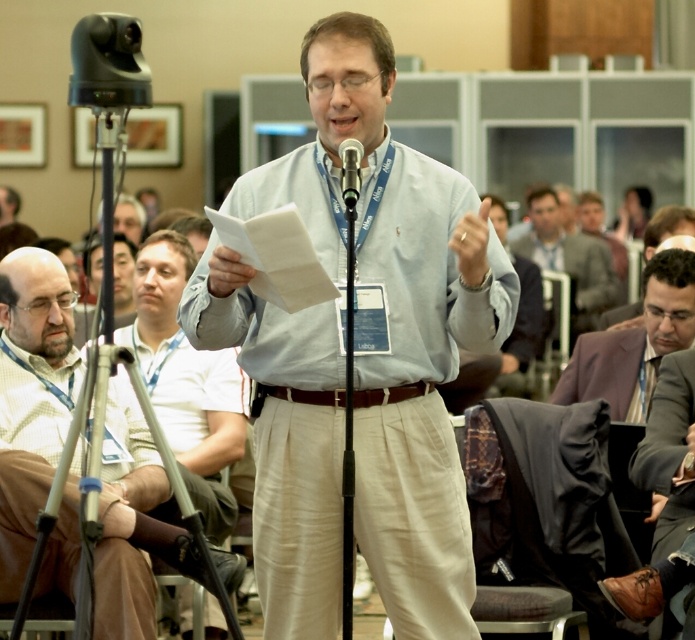
You are organizing a photoshoot and need to ensure that the light blue shirt at center and the light brown suit at center fit within a 3ft wide backdrop. Given their widths, will both items fit side by side?

The light blue shirt at center has a larger width than the light brown suit at center. Since the total width required would be more than 3ft, they cannot fit side by side within the backdrop.

You are organizing a photo shoot and need to ensure that the light brown sweater at left and the black metallic microphone at center are clearly visible in the frame. Which object should you focus on first to ensure proper lighting, considering their sizes?

The light brown sweater at left has a larger size compared to the black metallic microphone at center, so you should focus on the light brown sweater at left first to ensure proper lighting.